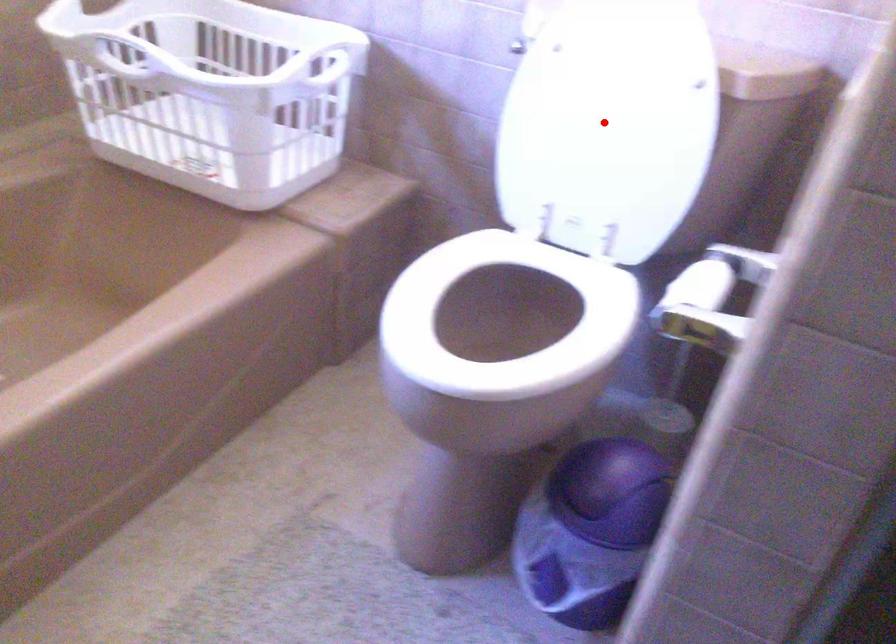
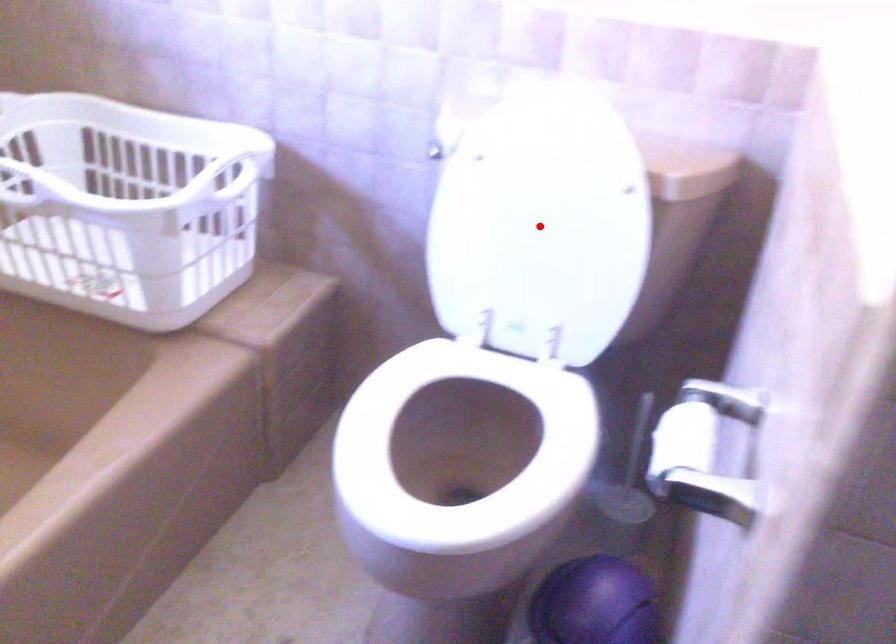
I am providing you with two images of the same scene from different viewpoints. A red point is marked on the first image and another point is marked on the second image. Does the point marked in image1 correspond to the same location as the one in image2?

Yes